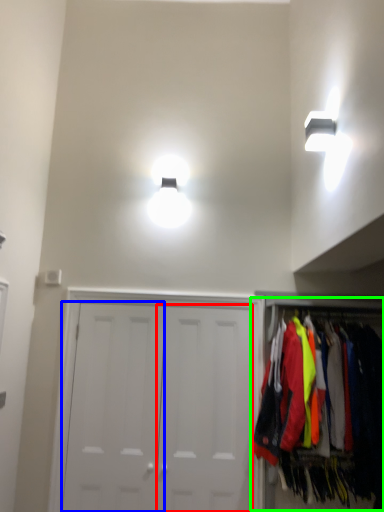
Question: Estimate the real-world distances between objects in this image. Which object is farther from door (highlighted by a red box), door (highlighted by a blue box) or closet (highlighted by a green box)?

Choices:
 (A) door
 (B) closet

Answer: (B)